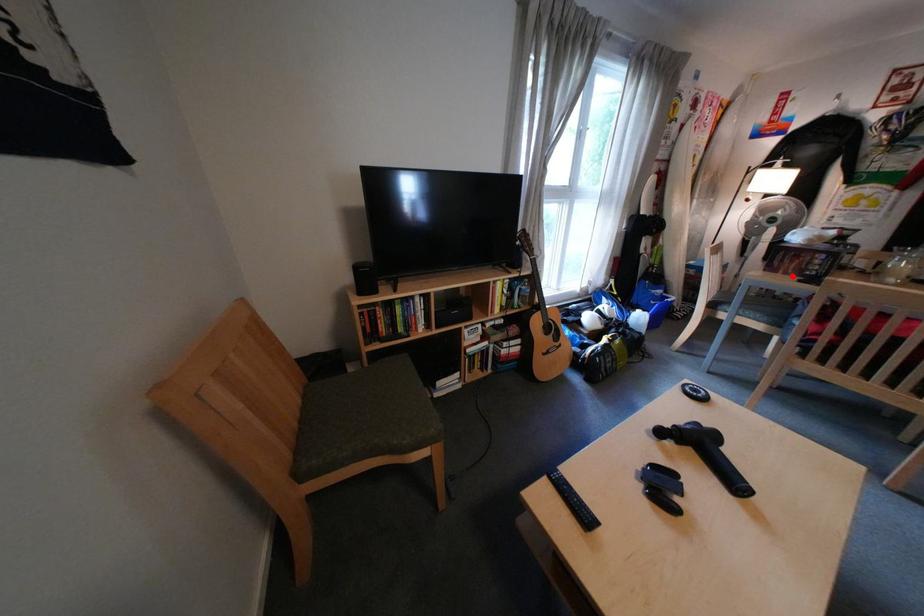
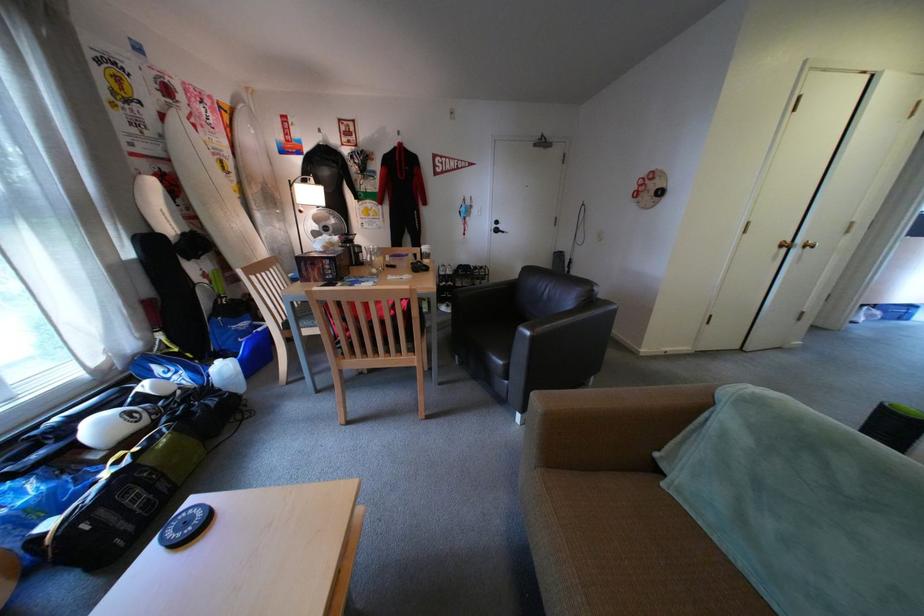
Find the pixel in the second image that matches the highlighted location in the first image.

(325, 285)